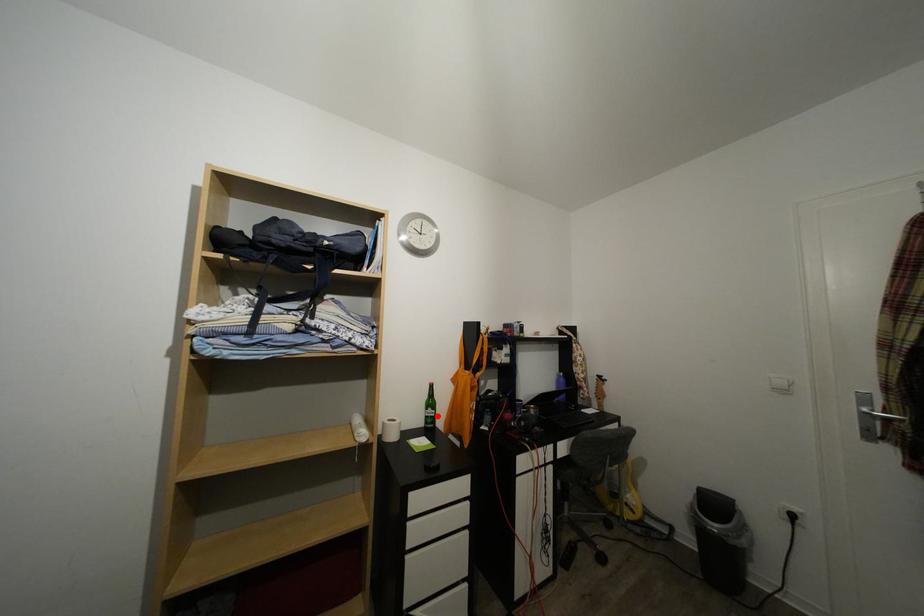
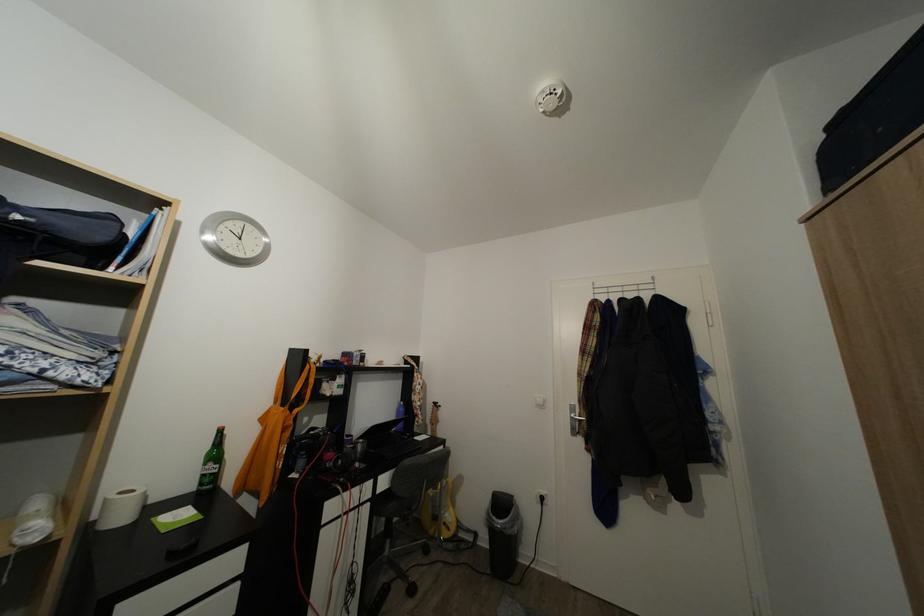
Locate, in the second image, the point that corresponds to the highlighted location in the first image.

(217, 471)